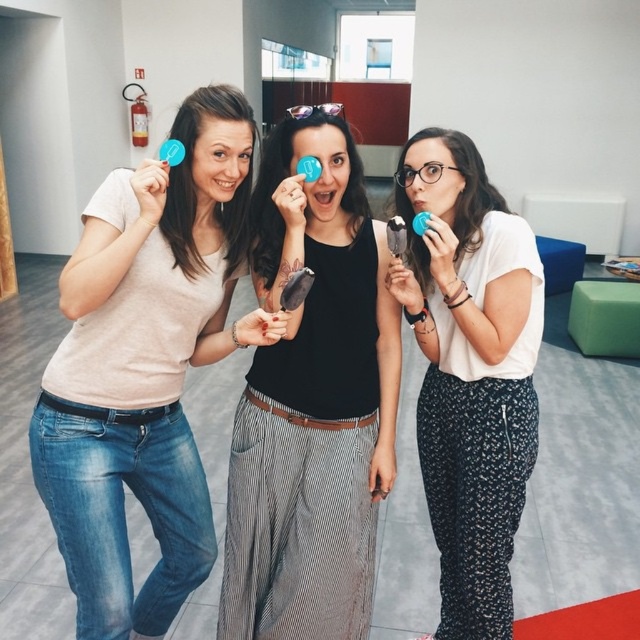
Question: Which point is farther to the camera?

Choices:
 (A) (284, 528)
 (B) (440, 326)

Answer: (B)

Question: Which point is closer to the camera?

Choices:
 (A) (269, 461)
 (B) (72, 300)

Answer: (B)

Question: Does matte pink t-shirt at left appear on the right side of black matte ice cream at center?

Choices:
 (A) yes
 (B) no

Answer: (B)

Question: Which point appears closest to the camera in this image?

Choices:
 (A) (336, 492)
 (B) (440, 408)
 (C) (125, 614)

Answer: (C)

Question: Is black matte ice cream at center thinner than white matte shirt at center?

Choices:
 (A) yes
 (B) no

Answer: (B)

Question: Can you confirm if matte pink t-shirt at left is positioned to the left of white matte shirt at center?

Choices:
 (A) no
 (B) yes

Answer: (B)